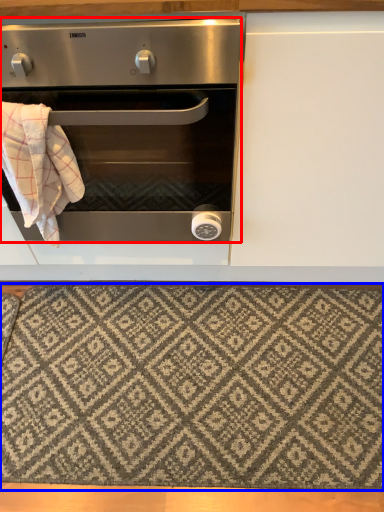
Question: Which point is closer to the camera, oven (highlighted by a red box) or mat (highlighted by a blue box)?

Choices:
 (A) oven
 (B) mat

Answer: (A)